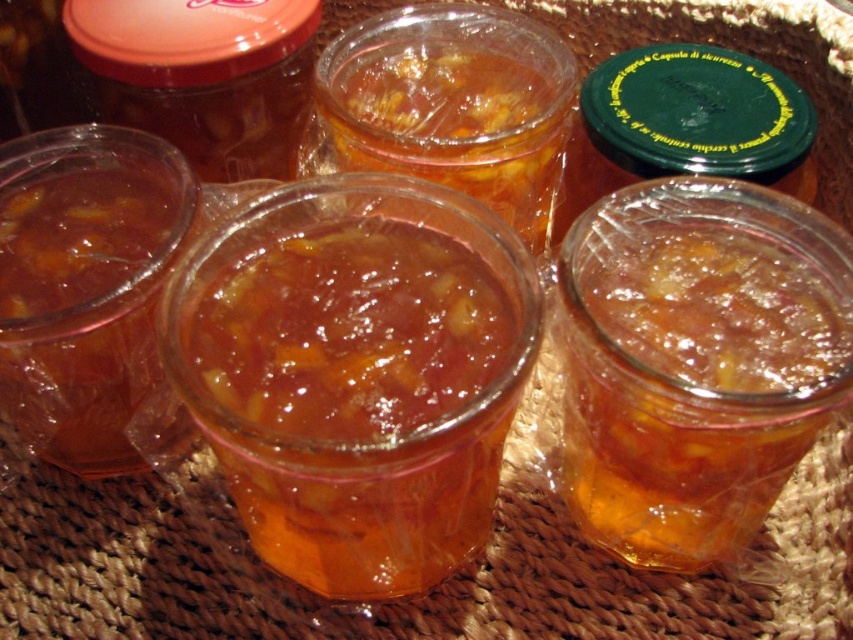
Is translucent glass jam at center closer to the viewer compared to translucent amber jam at center?

Yes, translucent glass jam at center is closer to the viewer.

Between point (370, 545) and point (691, 314), which one is positioned behind?

Point (370, 545)

Is point (461, 308) more distant than point (819, 387)?

Yes, point (461, 308) is behind point (819, 387).

Identify the location of translucent glass jam at center. (358, 401).